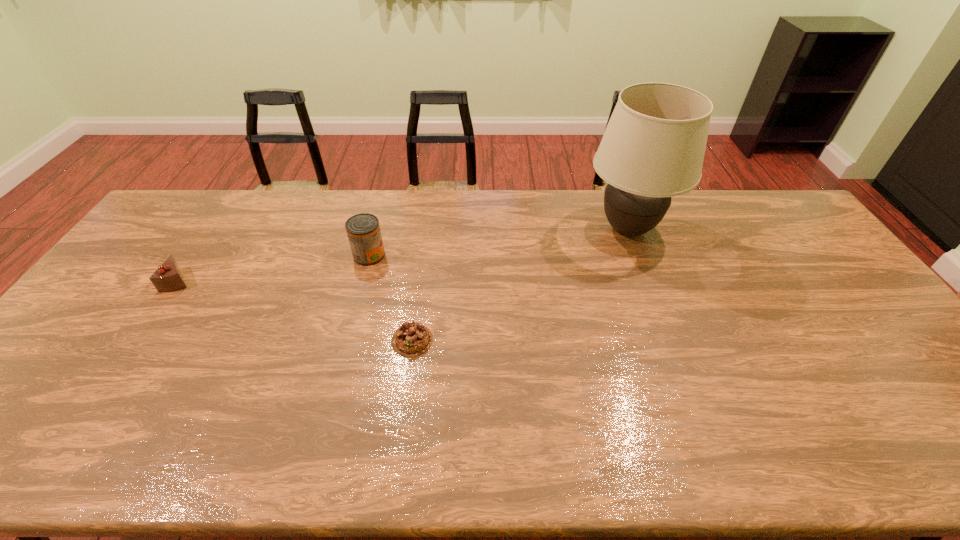
Find the location of a particular element. The width and height of the screenshot is (960, 540). vacant region between the second object from left to right and the tallest object is located at coordinates (498, 242).

Identify the location of empty space between the tallest object and the shortest object. (519, 285).

Find the location of `free space between the second object from left to right and the shortest object`. free space between the second object from left to right and the shortest object is located at coordinates (391, 298).

You are a GUI agent. You are given a task and a screenshot of the screen. Output one action in this format:
    pyautogui.click(x=<x>, y=<y>)
    Task: Click on the free spot between the leftmost object and the right chocolate cake
    
    Given the screenshot: What is the action you would take?
    pyautogui.click(x=296, y=310)

Identify the location of vacant area that lies between the shorter chocolate cake and the rightmost object. The width and height of the screenshot is (960, 540). (519, 285).

Identify the location of unoccupied area between the third object from left to right and the third farthest object. (296, 310).

Locate an element on the screen. This screenshot has width=960, height=540. free spot between the shorter chocolate cake and the lampshade is located at coordinates (519, 285).

Where is `unoccupied area between the third object from right to left and the shortest object`? unoccupied area between the third object from right to left and the shortest object is located at coordinates (391, 298).

Select which object is the closest to the third tallest object. Please provide its 2D coordinates. Your answer should be formatted as a tuple, i.e. [(x, y)], where the tuple contains the x and y coordinates of a point satisfying the conditions above.

[(363, 230)]

The width and height of the screenshot is (960, 540). In order to click on object that ranks as the second closest to the can in this screenshot , I will do `click(168, 277)`.